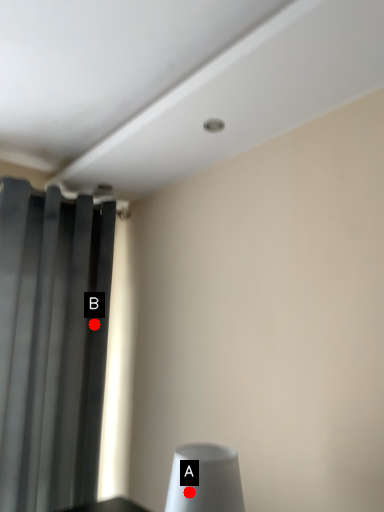
Question: Two points are circled on the image, labeled by A and B beside each circle. Which point is closer to the camera?

Choices:
 (A) A is closer
 (B) B is closer

Answer: (A)